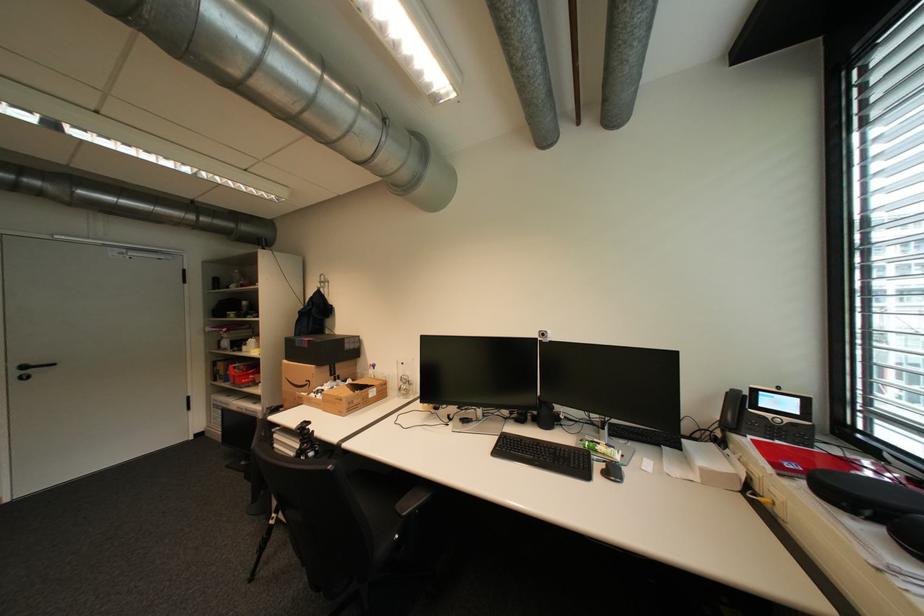
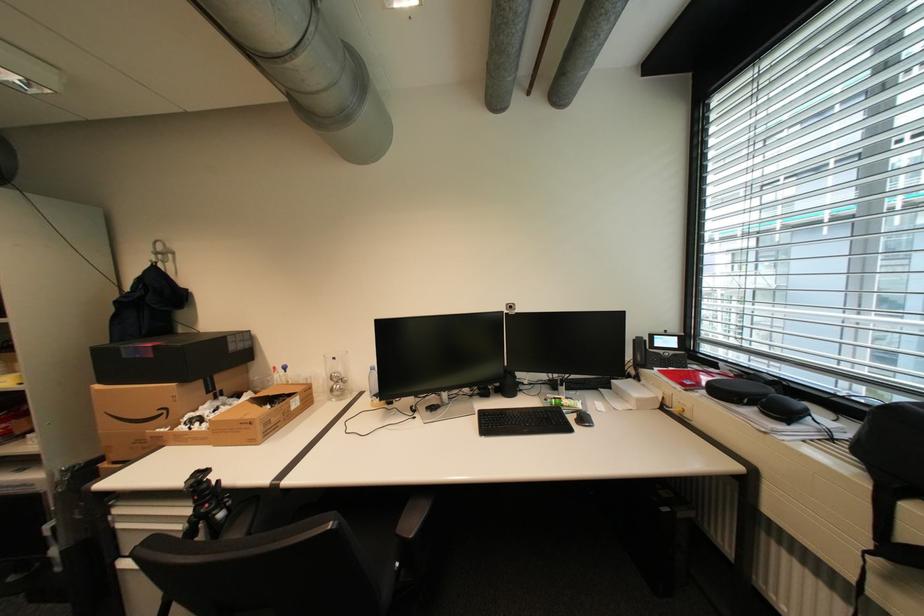
Question: The camera is either moving clockwise (left) or counter-clockwise (right) around the object. The first image is from the beginning of the video and the second image is from the end. Is the camera moving left or right when shooting the video?

Choices:
 (A) Left
 (B) Right

Answer: (A)